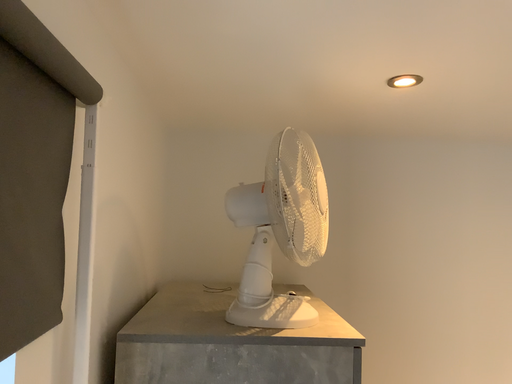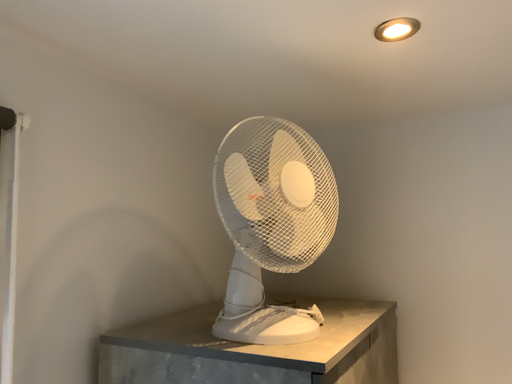
Question: Which way did the camera rotate in the video?

Choices:
 (A) rotated left
 (B) rotated right

Answer: (A)